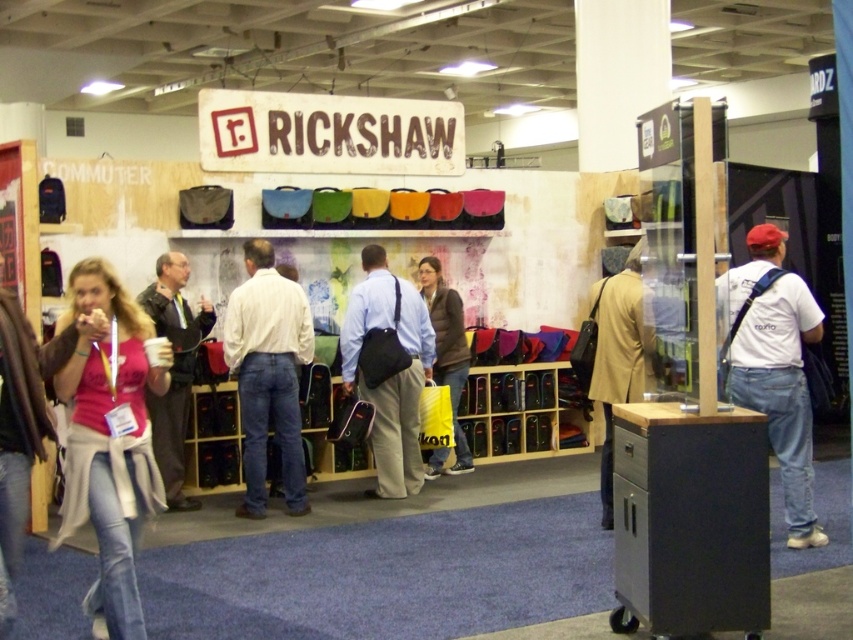
Question: Does white cotton t-shirt at right have a lesser width compared to light brown leather jacket at center?

Choices:
 (A) yes
 (B) no

Answer: (B)

Question: Can you confirm if matte black bag at center is positioned below matte yellow bag at center?

Choices:
 (A) no
 (B) yes

Answer: (A)

Question: Which of the following is the farthest from the observer?

Choices:
 (A) matte black bag at center
 (B) matte black jacket at left

Answer: (A)

Question: Which point is closer to the camera taking this photo?

Choices:
 (A) (175, 497)
 (B) (734, 349)

Answer: (B)

Question: Which point is closer to the camera?

Choices:
 (A) pyautogui.click(x=161, y=477)
 (B) pyautogui.click(x=790, y=403)
 (C) pyautogui.click(x=136, y=497)
 (D) pyautogui.click(x=451, y=388)

Answer: (C)

Question: Does matte pink shirt at lower left lie behind matte yellow bag at center?

Choices:
 (A) no
 (B) yes

Answer: (A)